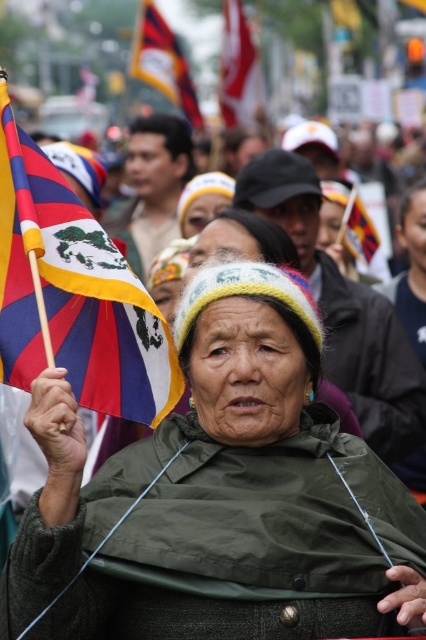
Can you confirm if green knitted hat at upper center is thinner than polyester flag at left?

In fact, green knitted hat at upper center might be wider than polyester flag at left.

Identify the location of green knitted hat at upper center. (215, 496).

What do you see at coordinates (215, 496) in the screenshot? The width and height of the screenshot is (426, 640). I see `green knitted hat at upper center` at bounding box center [215, 496].

Locate an element on the screen. green knitted hat at upper center is located at coordinates (215, 496).

Which is behind, point (72, 445) or point (227, 20)?

The point (227, 20) is more distant.

Is green knitted hat at upper center below white fabric flag at upper center?

Correct, green knitted hat at upper center is located below white fabric flag at upper center.

Measure the distance between green knitted hat at upper center and camera.

green knitted hat at upper center is 19.90 meters away from camera.

In order to click on green knitted hat at upper center in this screenshot , I will do `click(215, 496)`.

How far apart are green knitted hat at upper center and striped fabric flag at upper center?

A distance of 409.44 feet exists between green knitted hat at upper center and striped fabric flag at upper center.

Does green knitted hat at upper center lie behind striped fabric flag at upper center?

That is False.

Does point (199, 589) lie behind point (141, 10)?

No.

The height and width of the screenshot is (640, 426). Identify the location of green knitted hat at upper center. (215, 496).